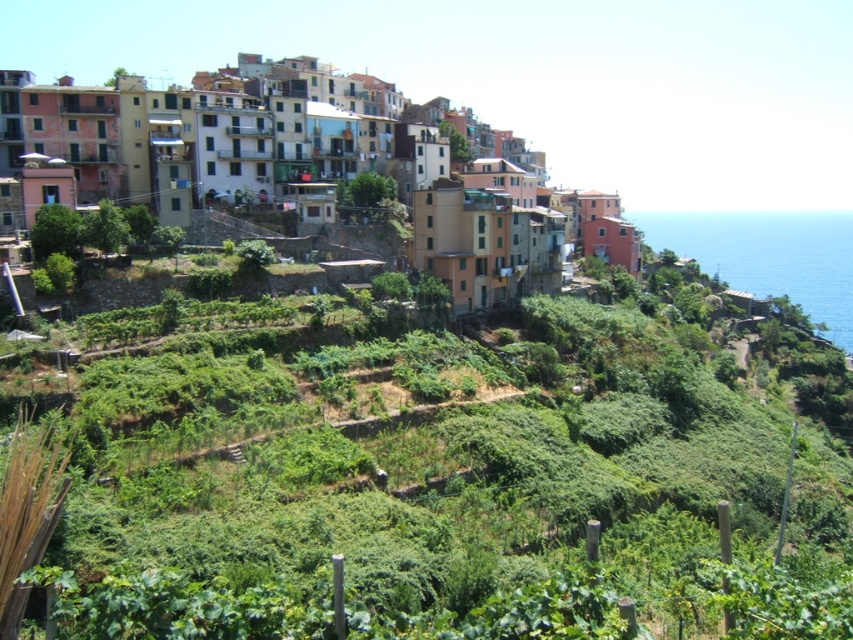
You are standing in the coastal village and want to take a photo of the multicolored stone buildings at upper center without any green leafy plants at center blocking the view. What should you do?

Move backward to position yourself further away from the green leafy plants at center so that the multicolored stone buildings at upper center become visible without obstruction from the plants.

You are a tourist standing at the entrance of the coastal village. You want to take a photo of the green leafy plants at center. Where should you position yourself to capture them in the frame?

To capture the green leafy plants at center in your photo, position yourself at the entrance of the coastal village and aim your camera towards the coordinates point (438,486) where the green leafy plants at center are located.

You are a visitor standing at the entrance of the coastal village. You see the green leafy plants at center and the blue liquid water at right. Which object is taller when viewed from your perspective?

The blue liquid water at right is taller than the green leafy plants at center.